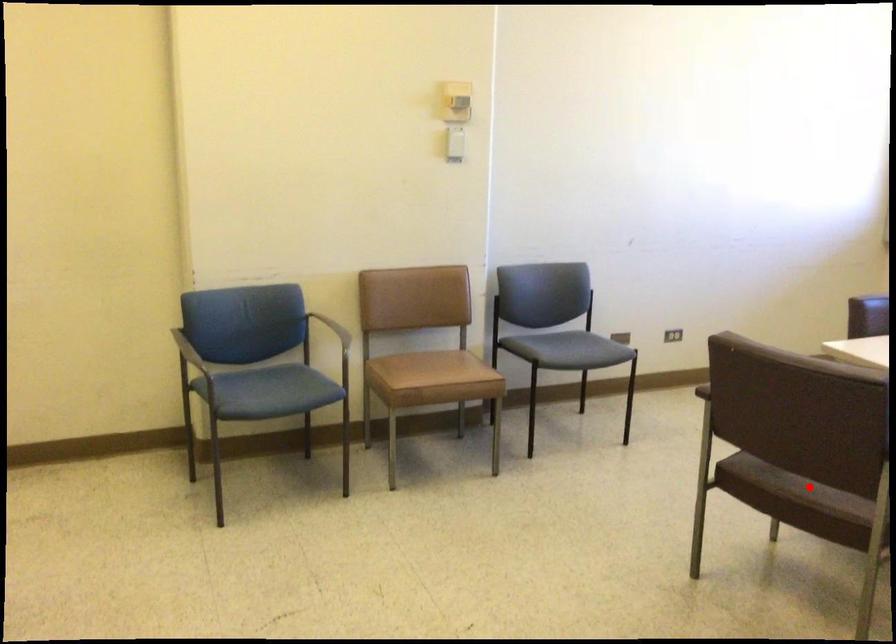
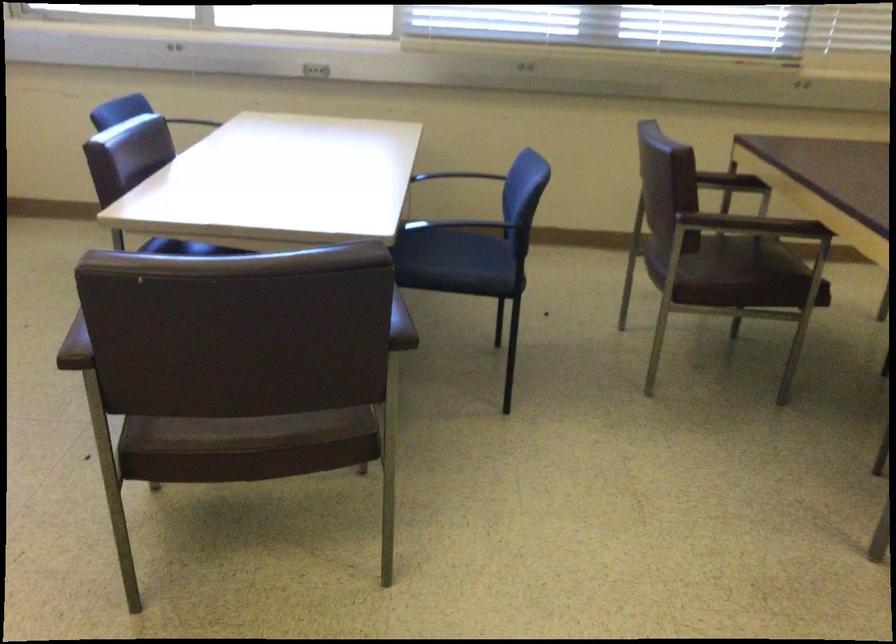
Question: I am providing you with two images of the same scene from different viewpoints. A red point is shown in image1. For the corresponding object point in image2, is it positioned nearer or farther from the camera?

Choices:
 (A) Nearer
 (B) Farther

Answer: (A)